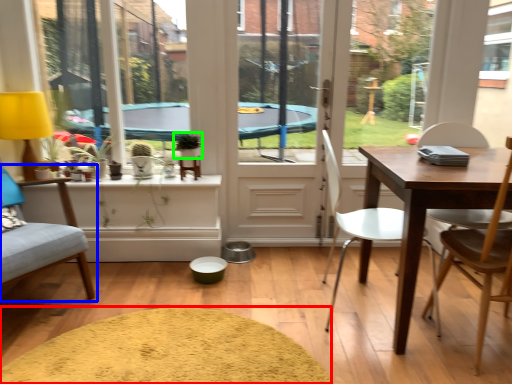
Question: Estimate the real-world distances between objects in this image. Which object is closer to wide (highlighted by a red box), chair (highlighted by a blue box) or plant (highlighted by a green box)?

Choices:
 (A) chair
 (B) plant

Answer: (A)